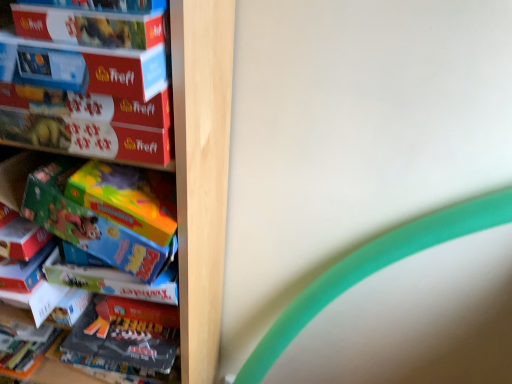
Locate an element on the screen. The width and height of the screenshot is (512, 384). matte red puzzle box at upper left, positioned as the first paperback book in bottom-to-top order is located at coordinates (84, 68).

Find the location of a particular element. This screenshot has width=512, height=384. wooden puzzle boxes at left is located at coordinates (201, 171).

You are a GUI agent. You are given a task and a screenshot of the screen. Output one action in this format:
    pyautogui.click(x=<x>, y=<y>)
    Task: Click on the matte cardboard box at upper left, acting as the second paperback book starting from the bottom
    This screenshot has width=512, height=384.
    Given the screenshot: What is the action you would take?
    pyautogui.click(x=91, y=26)

The width and height of the screenshot is (512, 384). Describe the element at coordinates (93, 85) in the screenshot. I see `matte cardboard puzzle box at left` at that location.

Image resolution: width=512 pixels, height=384 pixels. Describe the element at coordinates (59, 205) in the screenshot. I see `green matte toy at left` at that location.

Image resolution: width=512 pixels, height=384 pixels. Identify the location of matte red puzzle box at upper left, which is the second paperback book from top to bottom. (84, 68).

Is matte cardboard puzzle box at left spatially inside matte cardboard box at upper left, acting as the second paperback book starting from the bottom, or outside of it?

The correct answer is: outside.

From the image's perspective, does matte cardboard puzzle box at left appear higher than matte cardboard box at upper left, the first paperback book when ordered from top to bottom?

No, from the image's perspective, matte cardboard puzzle box at left is not above matte cardboard box at upper left, the first paperback book when ordered from top to bottom.

Which is farther, (94, 147) or (165, 35)?

Positioned behind is point (94, 147).

Which is more to the left, matte cardboard puzzle box at left or matte cardboard box at upper left, the first paperback book when ordered from top to bottom?

matte cardboard puzzle box at left is more to the left.

How far apart are green matte toy at left and matte cardboard box at upper left, the first paperback book when ordered from top to bottom?

green matte toy at left is 11.74 inches from matte cardboard box at upper left, the first paperback book when ordered from top to bottom.

Which of these two, green matte toy at left or matte cardboard box at upper left, acting as the second paperback book starting from the bottom, stands taller?

With more height is green matte toy at left.

From the image's perspective, is green matte toy at left over matte cardboard box at upper left, acting as the second paperback book starting from the bottom?

Incorrect, from the image's perspective, green matte toy at left is lower than matte cardboard box at upper left, acting as the second paperback book starting from the bottom.

Is matte cardboard box at upper left, the first paperback book when ordered from top to bottom, next to wooden puzzle boxes at left and touching it?

They are not placed beside each other.

Find the location of a particular element. This screenshot has height=384, width=512. shelf behind the matte cardboard box at upper left, the first paperback book when ordered from top to bottom is located at coordinates (201, 171).

Is matte cardboard box at upper left, the first paperback book when ordered from top to bottom, looking in the opposite direction of wooden puzzle boxes at left?

Yes, matte cardboard box at upper left, the first paperback book when ordered from top to bottom, is positioned with its back facing wooden puzzle boxes at left.

Between matte red puzzle box at upper left, positioned as the first paperback book in bottom-to-top order, and matte cardboard box at upper left, the first paperback book when ordered from top to bottom, which one has smaller size?

Smaller between the two is matte cardboard box at upper left, the first paperback book when ordered from top to bottom.

Is matte red puzzle box at upper left, positioned as the first paperback book in bottom-to-top order, wider or thinner than matte cardboard box at upper left, acting as the second paperback book starting from the bottom?

Considering their sizes, matte red puzzle box at upper left, positioned as the first paperback book in bottom-to-top order, looks slimmer than matte cardboard box at upper left, acting as the second paperback book starting from the bottom.

Are matte red puzzle box at upper left, positioned as the first paperback book in bottom-to-top order, and matte cardboard box at upper left, acting as the second paperback book starting from the bottom, far apart?

No.

Who is more distant, matte red puzzle box at upper left, which is the second paperback book from top to bottom, or matte cardboard box at upper left, the first paperback book when ordered from top to bottom?

matte red puzzle box at upper left, which is the second paperback book from top to bottom.

From the image's perspective, is matte cardboard box at upper left, acting as the second paperback book starting from the bottom, above matte cardboard puzzle box at left?

Yes, from the image's perspective, matte cardboard box at upper left, acting as the second paperback book starting from the bottom, is on top of matte cardboard puzzle box at left.

Considering the sizes of objects matte cardboard box at upper left, acting as the second paperback book starting from the bottom, and matte cardboard puzzle box at left in the image provided, who is shorter, matte cardboard box at upper left, acting as the second paperback book starting from the bottom, or matte cardboard puzzle box at left?

matte cardboard box at upper left, acting as the second paperback book starting from the bottom.

Considering the points (69, 8) and (94, 143), which point is in front, point (69, 8) or point (94, 143)?

Point (69, 8)

Between matte cardboard box at upper left, the first paperback book when ordered from top to bottom, and matte cardboard puzzle box at left, which one has smaller size?

Smaller between the two is matte cardboard box at upper left, the first paperback book when ordered from top to bottom.

Is wooden puzzle boxes at left in contact with matte red puzzle box at upper left, which is the second paperback book from top to bottom?

There is a gap between wooden puzzle boxes at left and matte red puzzle box at upper left, which is the second paperback book from top to bottom.

From the image's perspective, is wooden puzzle boxes at left on top of matte red puzzle box at upper left, positioned as the first paperback book in bottom-to-top order?

Actually, wooden puzzle boxes at left appears below matte red puzzle box at upper left, positioned as the first paperback book in bottom-to-top order, in the image.

From a real-world perspective, is wooden puzzle boxes at left physically below matte red puzzle box at upper left, which is the second paperback book from top to bottom?

Yes, from a real-world perspective, wooden puzzle boxes at left is under matte red puzzle box at upper left, which is the second paperback book from top to bottom.

From the image's perspective, is green matte toy at left above matte red puzzle box at upper left, positioned as the first paperback book in bottom-to-top order?

No, from the image's perspective, green matte toy at left is not on top of matte red puzzle box at upper left, positioned as the first paperback book in bottom-to-top order.

Between green matte toy at left and matte red puzzle box at upper left, positioned as the first paperback book in bottom-to-top order, which one is positioned in front?

matte red puzzle box at upper left, positioned as the first paperback book in bottom-to-top order, is in front.

Image resolution: width=512 pixels, height=384 pixels. Find the location of `toy behind the matte red puzzle box at upper left, positioned as the first paperback book in bottom-to-top order`. toy behind the matte red puzzle box at upper left, positioned as the first paperback book in bottom-to-top order is located at coordinates (59, 205).

At what (x,y) coordinates should I click in order to perform the action: click on book on the left of matte cardboard box at upper left, the first paperback book when ordered from top to bottom. Please return your answer as a coordinate pair (x, y). Looking at the image, I should click on (93, 85).

Find the location of a particular element. This screenshot has height=384, width=512. paperback book that is the 2nd object to the right of the green matte toy at left, starting at the anchor is located at coordinates (91, 26).

From the image, which object appears to be nearer to wooden puzzle boxes at left, matte cardboard puzzle box at left or green matte toy at left?

matte cardboard puzzle box at left is positioned closer to the anchor wooden puzzle boxes at left.

Looking at the image, which one is located closer to matte cardboard box at upper left, acting as the second paperback book starting from the bottom, matte cardboard puzzle box at left or green matte toy at left?

matte cardboard puzzle box at left is closer to matte cardboard box at upper left, acting as the second paperback book starting from the bottom.

When comparing their distances from matte red puzzle box at upper left, which is the second paperback book from top to bottom, does green matte toy at left or matte cardboard box at upper left, acting as the second paperback book starting from the bottom, seem closer?

Among the two, matte cardboard box at upper left, acting as the second paperback book starting from the bottom, is located nearer to matte red puzzle box at upper left, which is the second paperback book from top to bottom.

Estimate the real-world distances between objects in this image. Which object is further from wooden puzzle boxes at left, matte cardboard puzzle box at left or matte cardboard box at upper left, acting as the second paperback book starting from the bottom?

matte cardboard box at upper left, acting as the second paperback book starting from the bottom.

Looking at the image, which one is located closer to matte cardboard puzzle box at left, green matte toy at left or matte cardboard box at upper left, the first paperback book when ordered from top to bottom?

matte cardboard box at upper left, the first paperback book when ordered from top to bottom, is positioned closer to the anchor matte cardboard puzzle box at left.

From the picture: Considering their positions, is matte red puzzle box at upper left, positioned as the first paperback book in bottom-to-top order, positioned further to matte cardboard box at upper left, acting as the second paperback book starting from the bottom, than green matte toy at left?

Based on the image, green matte toy at left appears to be further to matte cardboard box at upper left, acting as the second paperback book starting from the bottom.

From the image, which object appears to be farther from wooden puzzle boxes at left, matte cardboard puzzle box at left or matte red puzzle box at upper left, which is the second paperback book from top to bottom?

matte red puzzle box at upper left, which is the second paperback book from top to bottom, is further to wooden puzzle boxes at left.

From the image, which object appears to be farther from wooden puzzle boxes at left, matte cardboard box at upper left, acting as the second paperback book starting from the bottom, or matte cardboard puzzle box at left?

matte cardboard box at upper left, acting as the second paperback book starting from the bottom, is further to wooden puzzle boxes at left.

Locate an element on the screen. toy that lies between matte red puzzle box at upper left, which is the second paperback book from top to bottom, and wooden puzzle boxes at left from top to bottom is located at coordinates (59, 205).

Where is `book that lies between matte cardboard box at upper left, acting as the second paperback book starting from the bottom, and wooden puzzle boxes at left from top to bottom`? This screenshot has height=384, width=512. book that lies between matte cardboard box at upper left, acting as the second paperback book starting from the bottom, and wooden puzzle boxes at left from top to bottom is located at coordinates (93, 85).

Where is `paperback book between matte cardboard box at upper left, acting as the second paperback book starting from the bottom, and wooden puzzle boxes at left vertically`? The height and width of the screenshot is (384, 512). paperback book between matte cardboard box at upper left, acting as the second paperback book starting from the bottom, and wooden puzzle boxes at left vertically is located at coordinates (84, 68).

Identify the location of book located between green matte toy at left and matte cardboard box at upper left, acting as the second paperback book starting from the bottom, in the left-right direction. The height and width of the screenshot is (384, 512). (93, 85).